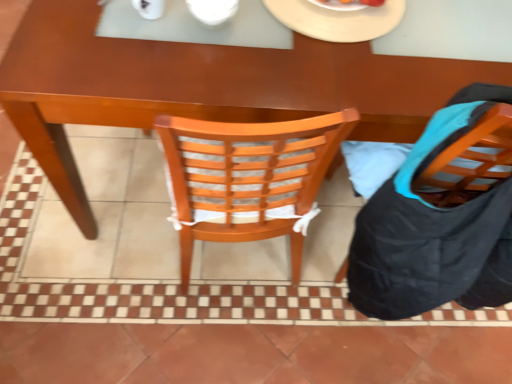
Where is `free space on the front side of white matte plate at upper center`? The width and height of the screenshot is (512, 384). free space on the front side of white matte plate at upper center is located at coordinates (325, 75).